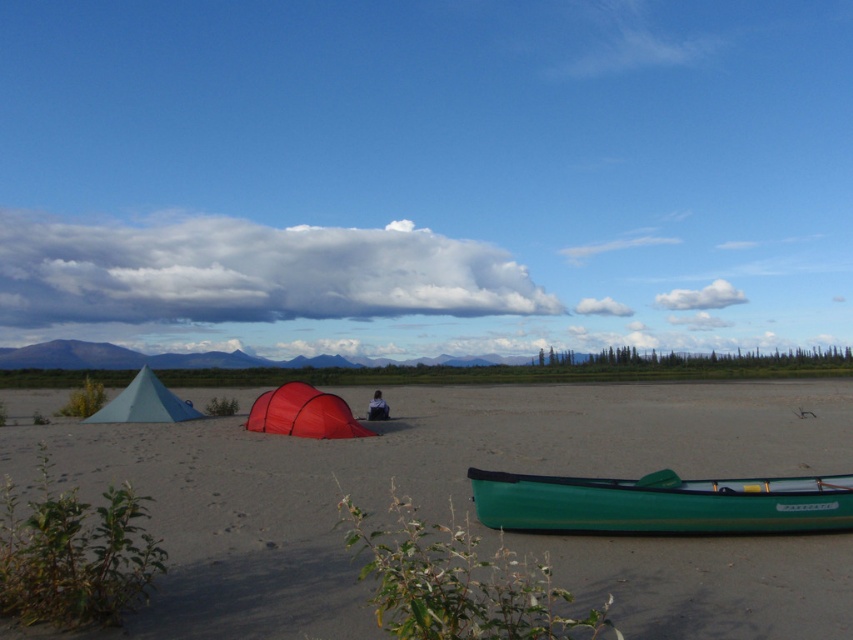
Question: Which object is closer to the camera taking this photo?

Choices:
 (A) green glossy canoe at lower center
 (B) matte blue tent at center

Answer: (B)

Question: Is matte blue tent at center positioned before dark blue fabric at center?

Choices:
 (A) yes
 (B) no

Answer: (A)

Question: Which of the following is the closest to the observer?

Choices:
 (A) matte red tent at center
 (B) matte green tent at left

Answer: (A)

Question: Does matte blue tent at center have a greater width compared to matte red tent at center?

Choices:
 (A) no
 (B) yes

Answer: (B)

Question: Which object is the farthest from the matte green tent at left?

Choices:
 (A) green glossy canoe at lower center
 (B) dark blue fabric at center
 (C) matte red tent at center

Answer: (A)

Question: Can you confirm if matte blue tent at center is bigger than dark blue fabric at center?

Choices:
 (A) yes
 (B) no

Answer: (A)